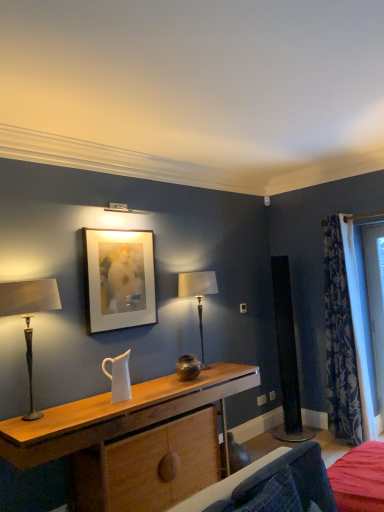
Question: Is velvet blue armchair at lower right in front of or behind matte bronze table lamp at center, the 1th table lamp positioned from the right, in the image?

Choices:
 (A) front
 (B) behind

Answer: (A)

Question: Based on their sizes in the image, would you say velvet blue armchair at lower right is bigger or smaller than matte bronze table lamp at center, the 1th table lamp positioned from the right?

Choices:
 (A) small
 (B) big

Answer: (A)

Question: Estimate the real-world distances between objects in this image. Which object is farther from the velvet blue armchair at lower right?

Choices:
 (A) matte bronze table lamp at left, which is the 2th table lamp from right to left
 (B) matte bronze table lamp at center, which ranks as the second table lamp in left-to-right order
 (C) wooden desk at center
 (D) matte white picture frame at upper center
 (E) blue floral fabric curtain at right

Answer: (E)

Question: Which is farther from the matte bronze table lamp at center, which ranks as the second table lamp in left-to-right order?

Choices:
 (A) wooden desk at center
 (B) matte white picture frame at upper center
 (C) velvet blue armchair at lower right
 (D) matte bronze table lamp at left, which is counted as the second table lamp, starting from the back
 (E) blue floral fabric curtain at right

Answer: (C)